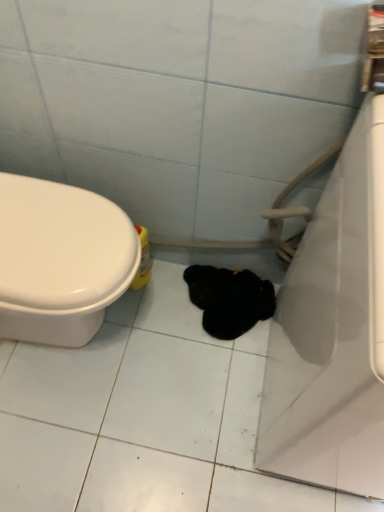
Question: Considering the positions of white glossy bathtub at right and black fuzzy animal at center in the image, is white glossy bathtub at right taller or shorter than black fuzzy animal at center?

Choices:
 (A) short
 (B) tall

Answer: (B)

Question: Would you say white glossy bathtub at right is inside or outside black fuzzy animal at center?

Choices:
 (A) inside
 (B) outside

Answer: (B)

Question: Which of these objects is positioned closest to the white glossy bathtub at right?

Choices:
 (A) black fuzzy animal at center
 (B) yellow plastic bottle at lower left

Answer: (A)

Question: Which is nearer to the black fuzzy animal at center?

Choices:
 (A) white glossy bathtub at right
 (B) yellow plastic bottle at lower left

Answer: (B)